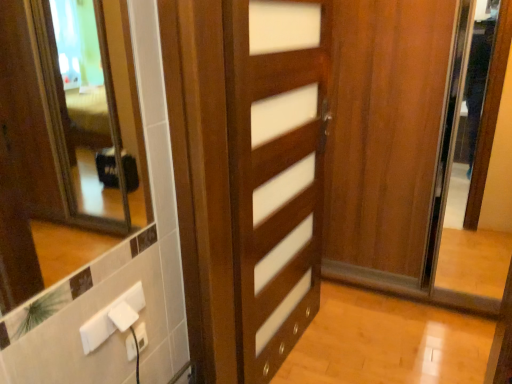
Question: Is wooden door at center shorter than white plastic electric outlet at lower left, the first electric outlet from the top?

Choices:
 (A) no
 (B) yes

Answer: (A)

Question: Could you tell me if wooden door at center is turned towards white plastic electric outlet at lower left, the 2th electric outlet in the bottom-to-top sequence?

Choices:
 (A) yes
 (B) no

Answer: (B)

Question: Can white plastic electric outlet at lower left, the first electric outlet from the top, be found inside wooden door at center?

Choices:
 (A) no
 (B) yes

Answer: (A)

Question: Considering the relative sizes of wooden door at center and white plastic electric outlet at lower left, the 2th electric outlet in the bottom-to-top sequence, in the image provided, is wooden door at center smaller than white plastic electric outlet at lower left, the 2th electric outlet in the bottom-to-top sequence,?

Choices:
 (A) no
 (B) yes

Answer: (A)

Question: Is wooden door at center far away from white plastic electric outlet at lower left, the 2th electric outlet in the bottom-to-top sequence?

Choices:
 (A) no
 (B) yes

Answer: (A)

Question: From the image's perspective, is wooden door at center positioned above or below white plastic electric outlet at lower left, the first electric outlet from the top?

Choices:
 (A) above
 (B) below

Answer: (A)

Question: Is wooden door at center in front of or behind white plastic electric outlet at lower left, the 2th electric outlet in the bottom-to-top sequence, in the image?

Choices:
 (A) behind
 (B) front

Answer: (A)

Question: From a real-world perspective, is wooden door at center above or below white plastic electric outlet at lower left, the 2th electric outlet in the bottom-to-top sequence?

Choices:
 (A) below
 (B) above

Answer: (B)

Question: From their relative heights in the image, would you say wooden door at center is taller or shorter than white plastic electric outlet at lower left, the 2th electric outlet in the bottom-to-top sequence?

Choices:
 (A) short
 (B) tall

Answer: (B)

Question: Considering the positions of white plastic electric outlet at lower center, positioned as the second electric outlet in top-to-bottom order, and white plastic electric outlet at lower left, the 2th electric outlet in the bottom-to-top sequence, in the image, is white plastic electric outlet at lower center, positioned as the second electric outlet in top-to-bottom order, wider or thinner than white plastic electric outlet at lower left, the 2th electric outlet in the bottom-to-top sequence,?

Choices:
 (A) thin
 (B) wide

Answer: (A)

Question: In terms of size, does white plastic electric outlet at lower center, positioned as the second electric outlet in top-to-bottom order, appear bigger or smaller than white plastic electric outlet at lower left, the first electric outlet from the top?

Choices:
 (A) small
 (B) big

Answer: (A)

Question: Do you think white plastic electric outlet at lower center, positioned as the second electric outlet in top-to-bottom order, is within white plastic electric outlet at lower left, the first electric outlet from the top, or outside of it?

Choices:
 (A) outside
 (B) inside

Answer: (A)

Question: From the image's perspective, is white plastic electric outlet at lower center, positioned as the second electric outlet in top-to-bottom order, located above or below white plastic electric outlet at lower left, the first electric outlet from the top?

Choices:
 (A) above
 (B) below

Answer: (B)

Question: From their relative heights in the image, would you say white plastic electric outlet at lower left, the 2th electric outlet in the bottom-to-top sequence, is taller or shorter than white plastic electric outlet at lower center, positioned as the second electric outlet in top-to-bottom order?

Choices:
 (A) short
 (B) tall

Answer: (B)

Question: From the image's perspective, relative to white plastic electric outlet at lower center, positioned as the second electric outlet in top-to-bottom order, is white plastic electric outlet at lower left, the first electric outlet from the top, above or below?

Choices:
 (A) above
 (B) below

Answer: (A)